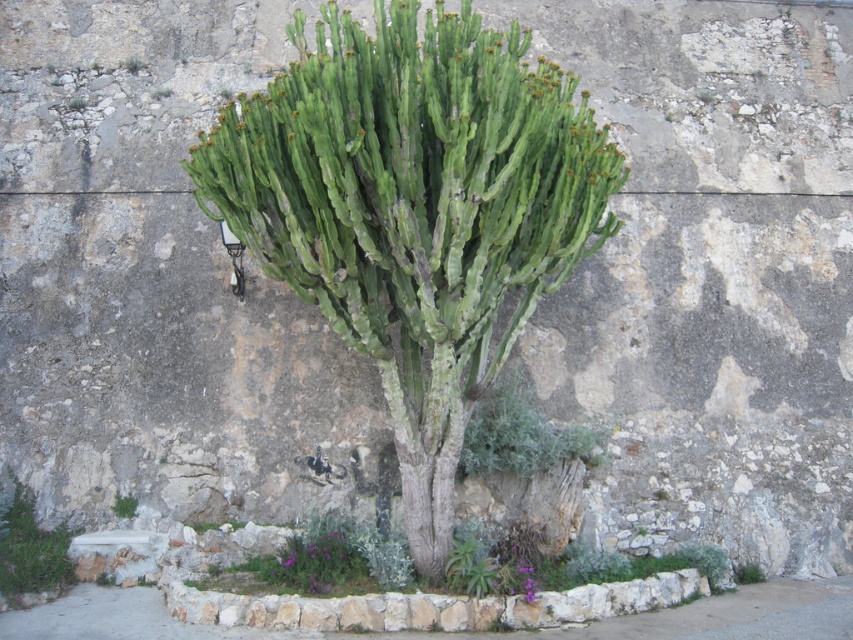
You are a gardener looking at the image. You need to water both the green woody at center and the green succulent at lower left. Which one should you water first if you start from the left side of the scene?

The green succulent at lower left should be watered first since it is located on the left side of the green woody at center, which is positioned to its right.

You are standing in front of a large cactus plant growing in front of a weathered stone wall. You see a point at coordinates (x=415, y=209). What is located at that point?

The point at coordinates (x=415, y=209) indicates a green woody at center.

You are standing in front of a large cactus plant growing in front of a weathered stone wall. The cactus has a dense, rounded shape with numerous green stems radiating outward from a central trunk. There is a point at coordinates (415,209). What is located at this point?

The point at coordinates (415,209) indicates a green woody area at the center of the cactus plant.